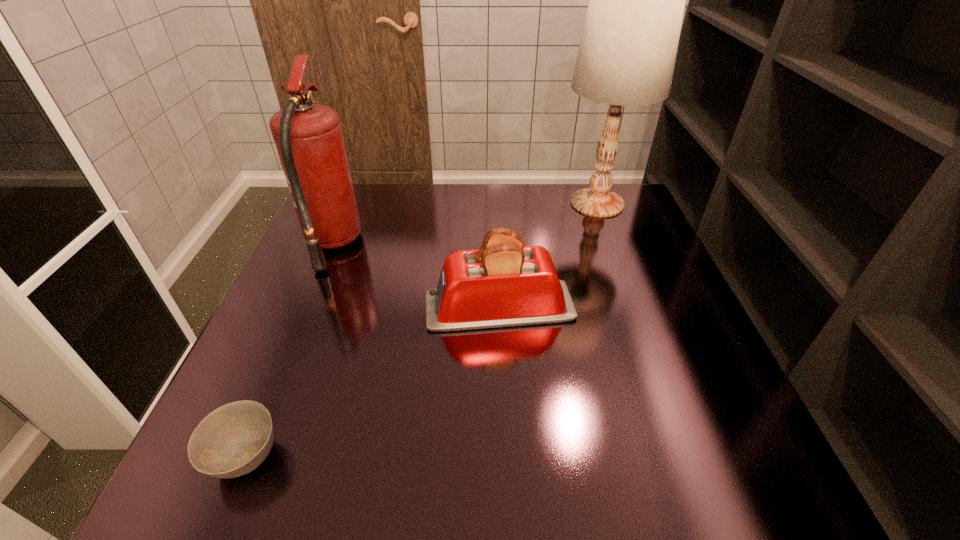
I want to click on free space located on the back of the nearest object, so click(317, 287).

Find the location of `lamp that is at the far edge`. lamp that is at the far edge is located at coordinates (628, 48).

Identify the location of fire extinguisher at the far edge. This screenshot has width=960, height=540. (308, 137).

The image size is (960, 540). In order to click on object that is at the near edge in this screenshot , I will do `click(233, 440)`.

I want to click on fire extinguisher at the left edge, so click(x=308, y=137).

This screenshot has height=540, width=960. Find the location of `bowl located in the left edge section of the desktop`. bowl located in the left edge section of the desktop is located at coordinates (233, 440).

Locate an element on the screen. object at the right edge is located at coordinates (628, 48).

Locate an element on the screen. Image resolution: width=960 pixels, height=540 pixels. object positioned at the far left corner is located at coordinates (308, 137).

You are a GUI agent. You are given a task and a screenshot of the screen. Output one action in this format:
    pyautogui.click(x=<x>, y=<y>)
    Task: Click on the object located in the near left corner section of the desktop
    
    Given the screenshot: What is the action you would take?
    pyautogui.click(x=233, y=440)

The image size is (960, 540). Identify the location of object at the far right corner. (628, 48).